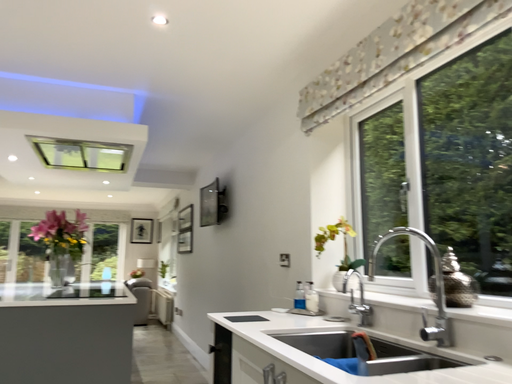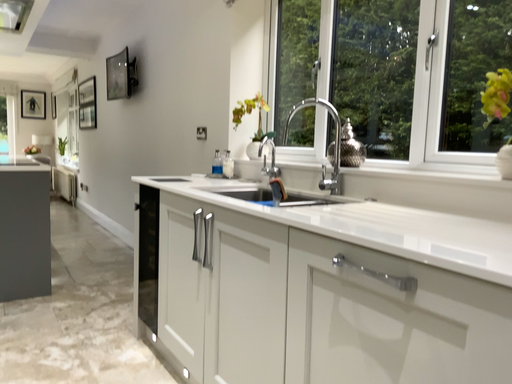
Question: Which way did the camera rotate in the video?

Choices:
 (A) rotated upward
 (B) rotated downward

Answer: (B)